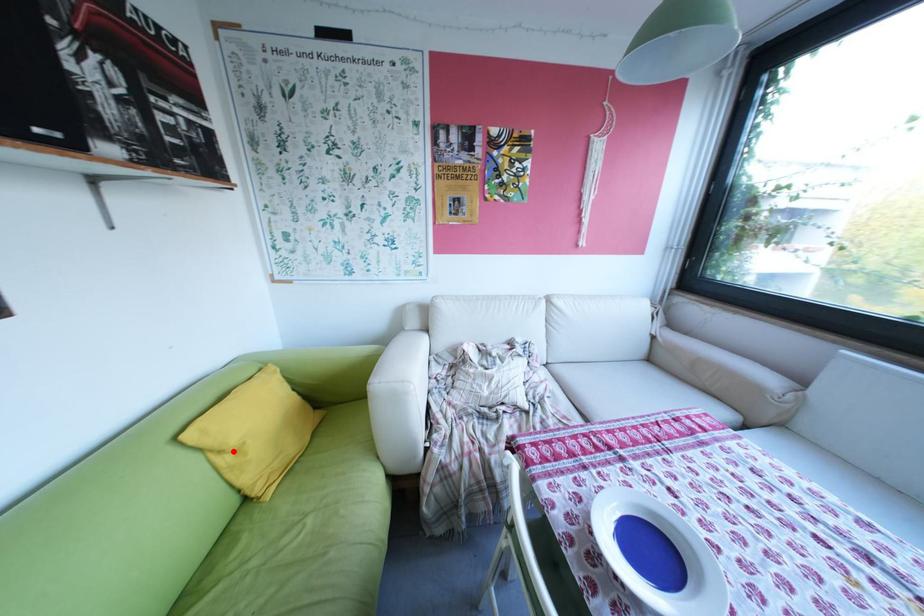
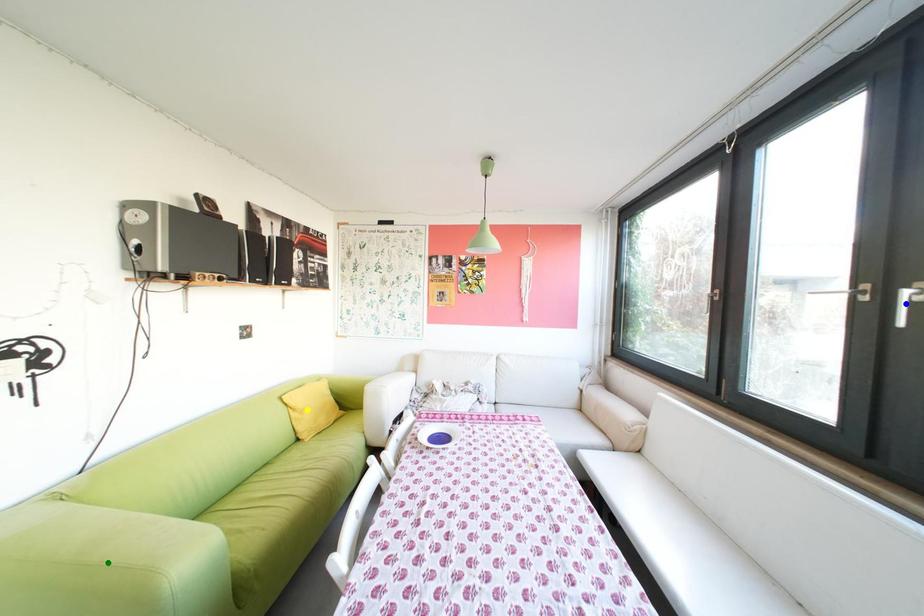
Question: I am providing you with two images of the same scene from different viewpoints. A red point is marked on the first image. You are given multiple points on the second image. In image 2, which mark is for the same physical point as the one in image 1?

Choices:
 (A) green point
 (B) yellow point
 (C) blue point

Answer: (B)